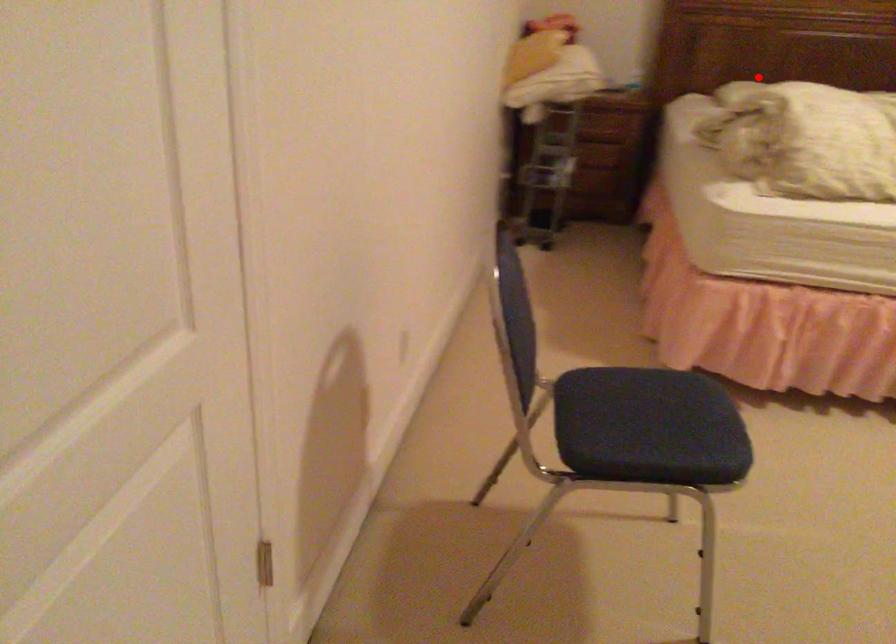
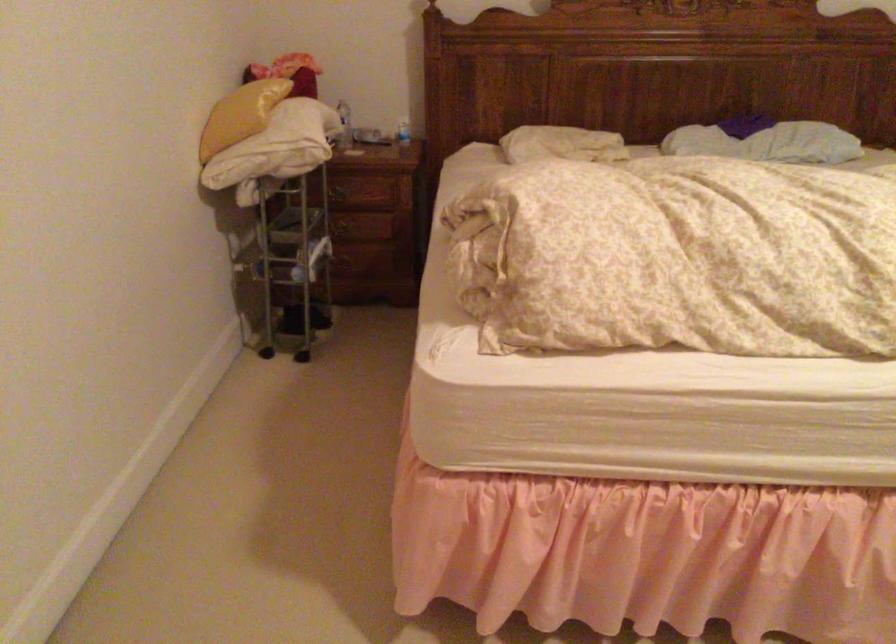
Where in the second image is the point corresponding to the highlighted location from the first image?

(561, 144)